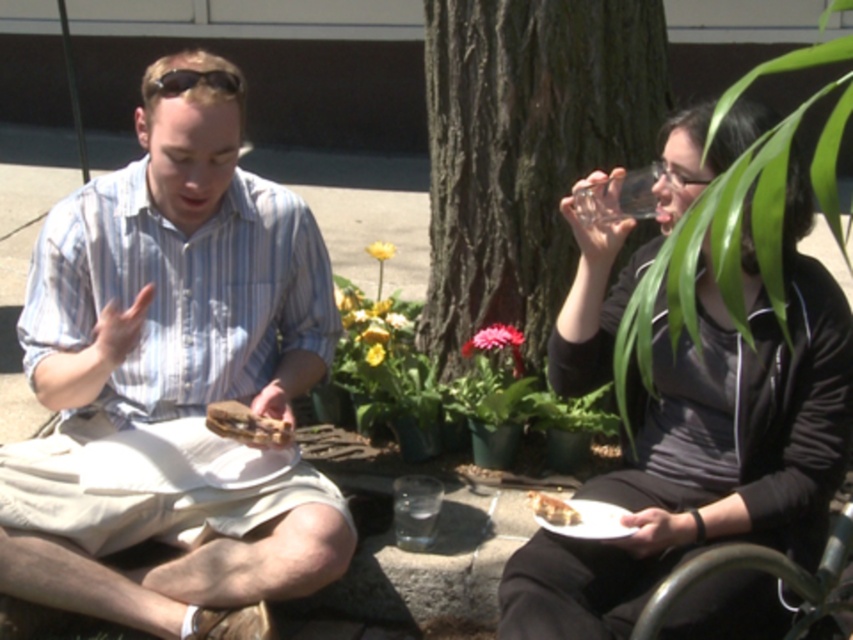
You are an observer looking at the scene. There are two people sitting outdoors. The first person is on the left wearing a light blue striped button up shirt and beige shorts, and the second person is on the right wearing a dark gray long sleeved shirt and dark pants. You notice a point at coordinates (171,371). What object is located at this point?

The object at point (171,371) is matte white shorts at center.

You are a photographer trying to capture a closeup of the crumbly brown bread at lower center without the dark brown bark tree at center blocking the view. Is this possible?

The crumbly brown bread at lower center is behind the dark brown bark tree at center, so it will be blocked by the tree and cannot be captured without the tree in the way.

You are a waiter at this outdoor table. You need to place a new drink order for the customer wearing the matte black sunglasses at upper center. The drink must be placed within 3 feet of their current position. Can you place it near the crumbly brown bread at lower center?

The distance between the matte black sunglasses at upper center and the crumbly brown bread at lower center is 3.79 feet. Since the required placement is within 3 feet, the drink cannot be placed near the crumbly brown bread at lower center as it exceeds the allowed distance.